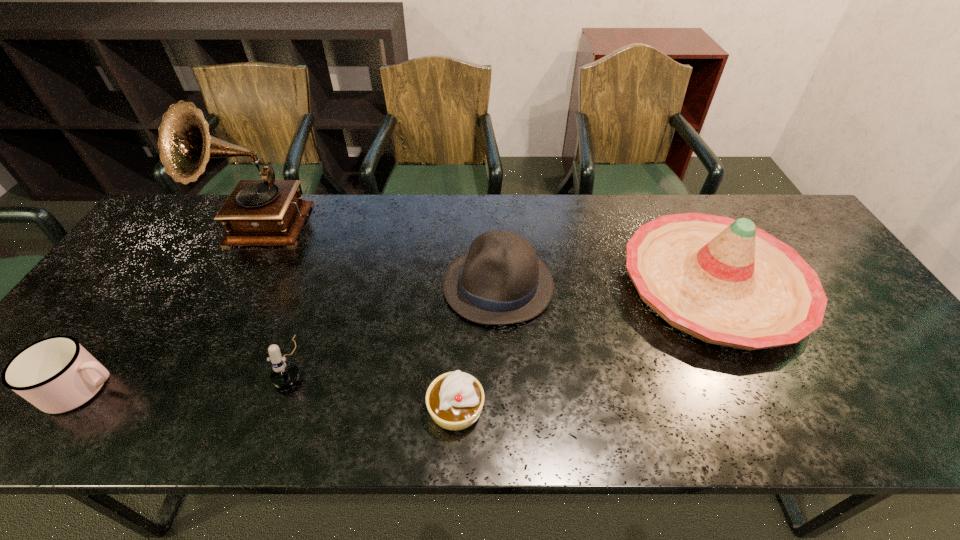
The height and width of the screenshot is (540, 960). In order to click on free point that satisfies the following two spatial constraints: 1. on the front-facing side of the third tallest object; 2. on the left side of the rightmost object in this screenshot , I will do `click(498, 286)`.

Where is `free space that satisfies the following two spatial constraints: 1. on the horn of the record player; 2. on the side of the mug with the handle`? The width and height of the screenshot is (960, 540). free space that satisfies the following two spatial constraints: 1. on the horn of the record player; 2. on the side of the mug with the handle is located at coordinates (174, 388).

At what (x,y) coordinates should I click in order to perform the action: click on vacant space that satisfies the following two spatial constraints: 1. on the front-facing side of the bowler hat; 2. on the front side of the whipped cream. Please return your answer as a coordinate pair (x, y). Image resolution: width=960 pixels, height=540 pixels. Looking at the image, I should click on (503, 408).

This screenshot has width=960, height=540. Identify the location of blank area in the image that satisfies the following two spatial constraints: 1. on the horn of the second tallest object; 2. on the left side of the record player. (229, 286).

I want to click on free space that satisfies the following two spatial constraints: 1. on the front side of the microphone; 2. on the side of the mug with the handle, so click(x=285, y=388).

Locate an element on the screen. This screenshot has width=960, height=540. free space that satisfies the following two spatial constraints: 1. on the side of the shortest object with the handle; 2. on the left side of the mug is located at coordinates (70, 408).

You are a GUI agent. You are given a task and a screenshot of the screen. Output one action in this format:
    pyautogui.click(x=<x>, y=<y>)
    Task: Click on the vacant area that satisfies the following two spatial constraints: 1. on the front side of the sombrero; 2. on the side of the mug with the handle
    Image resolution: width=960 pixels, height=540 pixels.
    Given the screenshot: What is the action you would take?
    pyautogui.click(x=764, y=388)